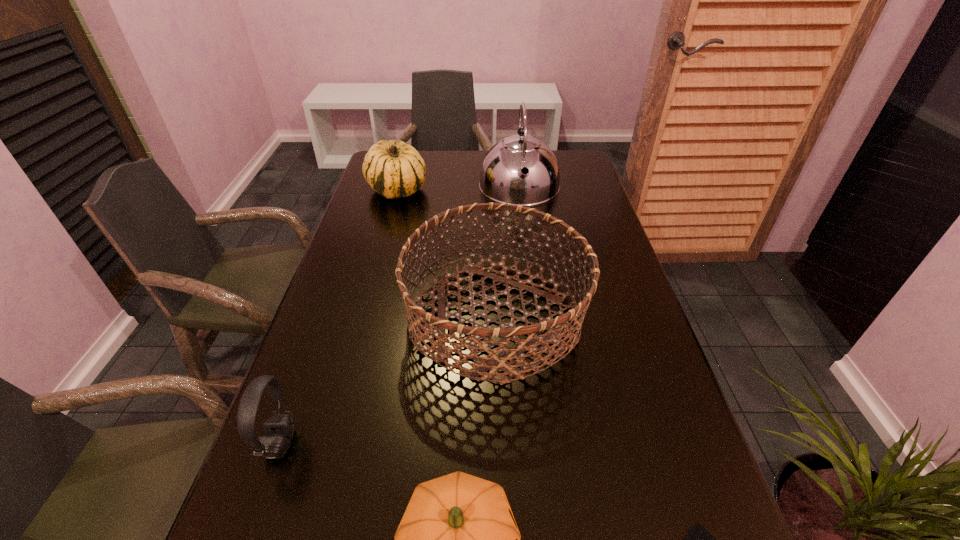
Locate an element on the screen. Image resolution: width=960 pixels, height=540 pixels. gourd located in the left edge section of the desktop is located at coordinates (394, 169).

Find the location of a particular element. This screenshot has width=960, height=540. headset present at the left edge is located at coordinates (279, 428).

You are a GUI agent. You are given a task and a screenshot of the screen. Output one action in this format:
    pyautogui.click(x=<x>, y=<y>)
    Task: Click on the kettle that is at the right edge
    
    Given the screenshot: What is the action you would take?
    pyautogui.click(x=521, y=170)

Where is `basket positioned at the right edge`? basket positioned at the right edge is located at coordinates (560, 324).

Locate an element on the screen. The height and width of the screenshot is (540, 960). object that is at the far left corner is located at coordinates (394, 169).

Find the location of a particular element. The height and width of the screenshot is (540, 960). object present at the far right corner is located at coordinates (521, 170).

In the image, there is a desktop. Identify the location of vacant space at the far edge. (480, 176).

Identify the location of free space at the left edge. The height and width of the screenshot is (540, 960). (353, 342).

Image resolution: width=960 pixels, height=540 pixels. Find the location of `free spot at the right edge of the desktop`. free spot at the right edge of the desktop is located at coordinates (559, 218).

Identify the location of vacant region between the basket and the kettle. Image resolution: width=960 pixels, height=540 pixels. (508, 252).